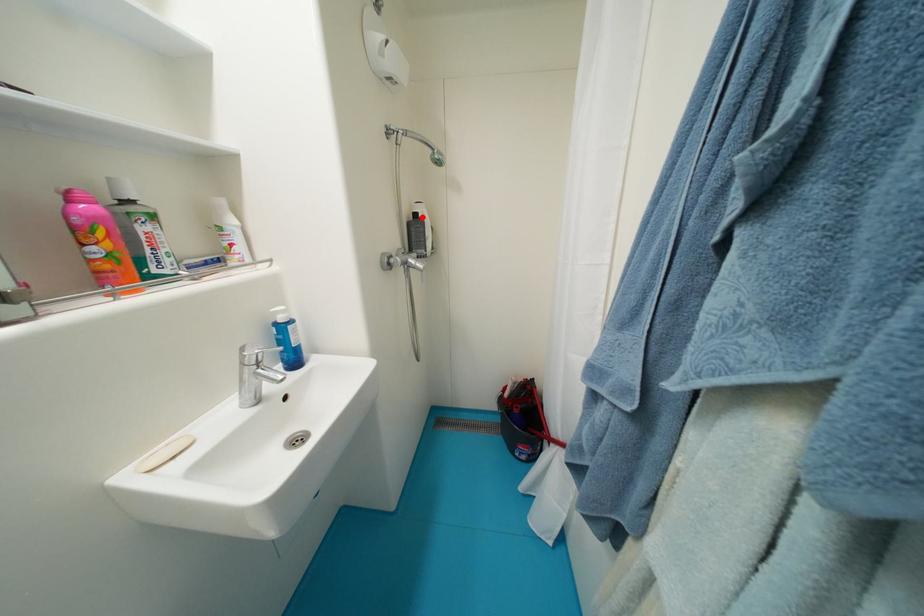
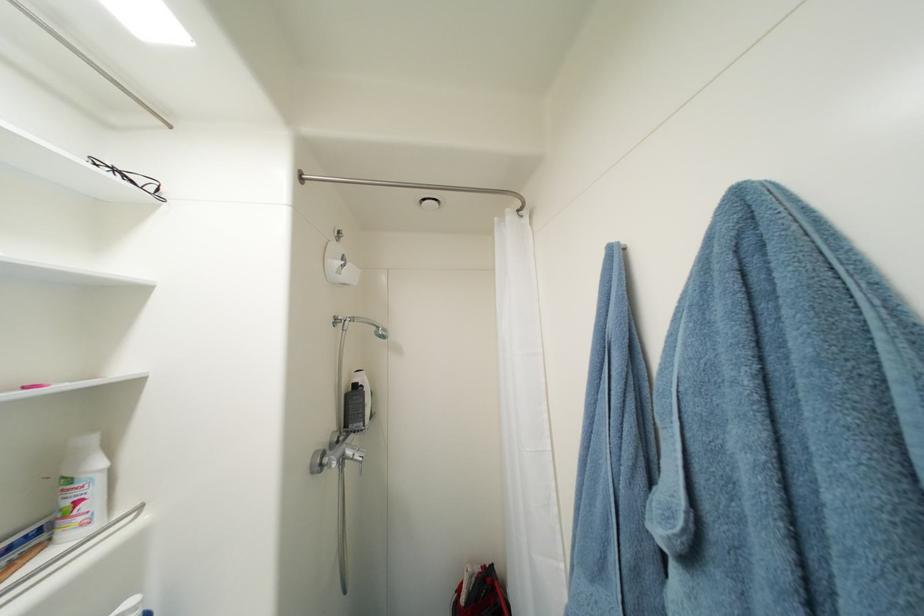
Where in the second image is the point corresponding to the highlighted location from the first image?

(361, 387)